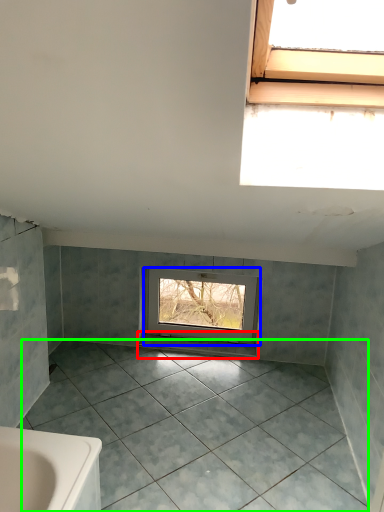
Question: Which object is the closest to the window sill (highlighted by a red box)? Choose among these: window (highlighted by a blue box) or ceramic tile (highlighted by a green box).

Choices:
 (A) window
 (B) ceramic tile

Answer: (A)